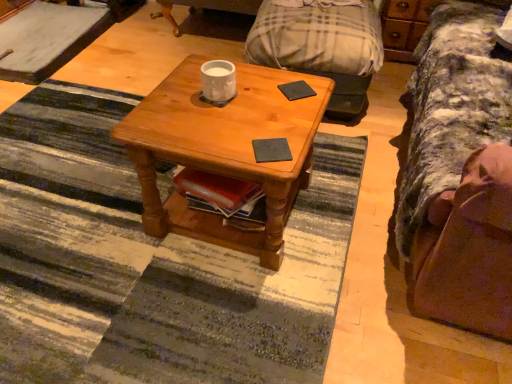
In order to click on blank area to the left of black matte pad at center, arranged as the 1th pad when viewed from the front in this screenshot , I will do `click(222, 142)`.